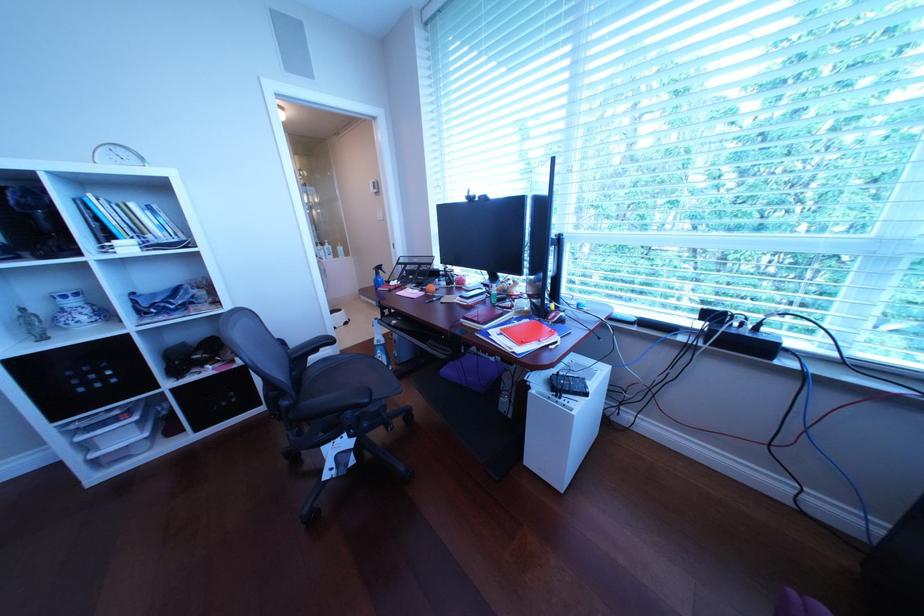
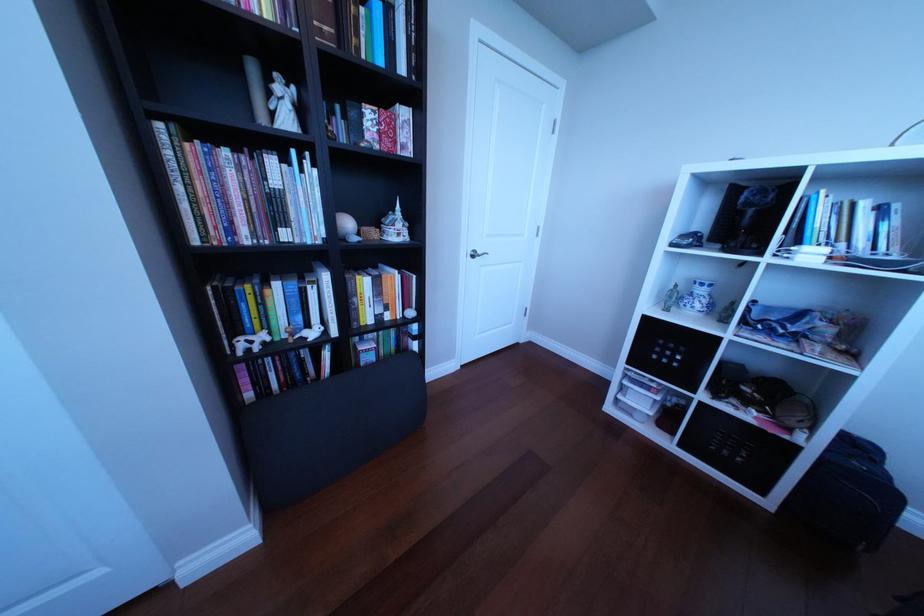
How did the camera likely rotate?

The rotation direction of the camera is left-down.